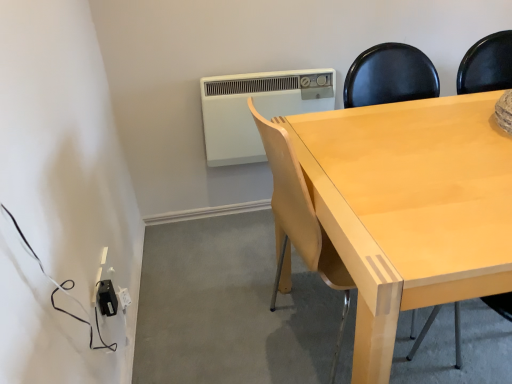
Question: Does black plastic outlet at lower left have a smaller size compared to light wood chair at center?

Choices:
 (A) no
 (B) yes

Answer: (B)

Question: From a real-world perspective, is black plastic outlet at lower left below light wood chair at center?

Choices:
 (A) no
 (B) yes

Answer: (B)

Question: Does black plastic outlet at lower left touch light wood chair at center?

Choices:
 (A) no
 (B) yes

Answer: (A)

Question: Is black plastic outlet at lower left bigger than light wood chair at center?

Choices:
 (A) yes
 (B) no

Answer: (B)

Question: Considering the relative sizes of black plastic outlet at lower left and light wood chair at center in the image provided, is black plastic outlet at lower left thinner than light wood chair at center?

Choices:
 (A) yes
 (B) no

Answer: (A)

Question: Is white plastic air conditioner at upper center situated inside light wood chair at center or outside?

Choices:
 (A) outside
 (B) inside

Answer: (A)

Question: Is white plastic air conditioner at upper center taller or shorter than light wood chair at center?

Choices:
 (A) short
 (B) tall

Answer: (A)

Question: Considering the positions of white plastic air conditioner at upper center and light wood chair at center in the image, is white plastic air conditioner at upper center bigger or smaller than light wood chair at center?

Choices:
 (A) small
 (B) big

Answer: (A)

Question: Is white plastic air conditioner at upper center wider or thinner than light wood chair at center?

Choices:
 (A) thin
 (B) wide

Answer: (A)

Question: In terms of width, does black plastic outlet at lower left look wider or thinner when compared to light wood chair at center?

Choices:
 (A) wide
 (B) thin

Answer: (B)

Question: In terms of height, does black plastic outlet at lower left look taller or shorter compared to light wood chair at center?

Choices:
 (A) short
 (B) tall

Answer: (A)

Question: From a real-world perspective, is black plastic outlet at lower left physically located above or below light wood chair at center?

Choices:
 (A) below
 (B) above

Answer: (A)

Question: From the image's perspective, is black plastic outlet at lower left positioned above or below light wood chair at center?

Choices:
 (A) above
 (B) below

Answer: (B)

Question: Is light wood chair at center inside the boundaries of black plastic outlet at lower left, or outside?

Choices:
 (A) inside
 (B) outside

Answer: (B)

Question: In terms of height, does light wood chair at center look taller or shorter compared to black plastic outlet at lower left?

Choices:
 (A) tall
 (B) short

Answer: (A)